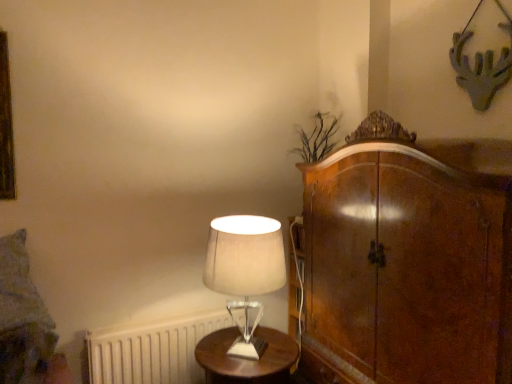
Question: From a real-world perspective, is wooden round table at center located beneath white matte radiator at lower left?

Choices:
 (A) yes
 (B) no

Answer: (B)

Question: Does wooden round table at center have a greater width compared to white matte radiator at lower left?

Choices:
 (A) no
 (B) yes

Answer: (B)

Question: Considering the relative sizes of wooden round table at center and white matte radiator at lower left in the image provided, is wooden round table at center shorter than white matte radiator at lower left?

Choices:
 (A) no
 (B) yes

Answer: (B)

Question: Is wooden round table at center at the left side of white matte radiator at lower left?

Choices:
 (A) yes
 (B) no

Answer: (B)

Question: Does wooden round table at center lie behind white matte radiator at lower left?

Choices:
 (A) no
 (B) yes

Answer: (A)

Question: From their relative heights in the image, would you say textured gray pillow at left is taller or shorter than wooden round table at center?

Choices:
 (A) tall
 (B) short

Answer: (A)

Question: Is textured gray pillow at left wider or thinner than wooden round table at center?

Choices:
 (A) wide
 (B) thin

Answer: (B)

Question: Do you think textured gray pillow at left is within wooden round table at center, or outside of it?

Choices:
 (A) outside
 (B) inside

Answer: (A)

Question: From the image's perspective, is textured gray pillow at left above or below wooden round table at center?

Choices:
 (A) below
 (B) above

Answer: (B)

Question: Is point (170, 377) positioned closer to the camera than point (272, 380)?

Choices:
 (A) closer
 (B) farther

Answer: (B)

Question: Choose the correct answer: Is white matte radiator at lower left inside wooden round table at center or outside it?

Choices:
 (A) inside
 (B) outside

Answer: (B)

Question: Considering their positions, is white matte radiator at lower left located in front of or behind wooden round table at center?

Choices:
 (A) behind
 (B) front

Answer: (A)

Question: Based on their sizes in the image, would you say white matte radiator at lower left is bigger or smaller than wooden round table at center?

Choices:
 (A) small
 (B) big

Answer: (A)

Question: From the image's perspective, is white matte radiator at lower left positioned above or below textured gray pillow at left?

Choices:
 (A) above
 (B) below

Answer: (B)

Question: Based on their sizes in the image, would you say white matte radiator at lower left is bigger or smaller than textured gray pillow at left?

Choices:
 (A) big
 (B) small

Answer: (A)